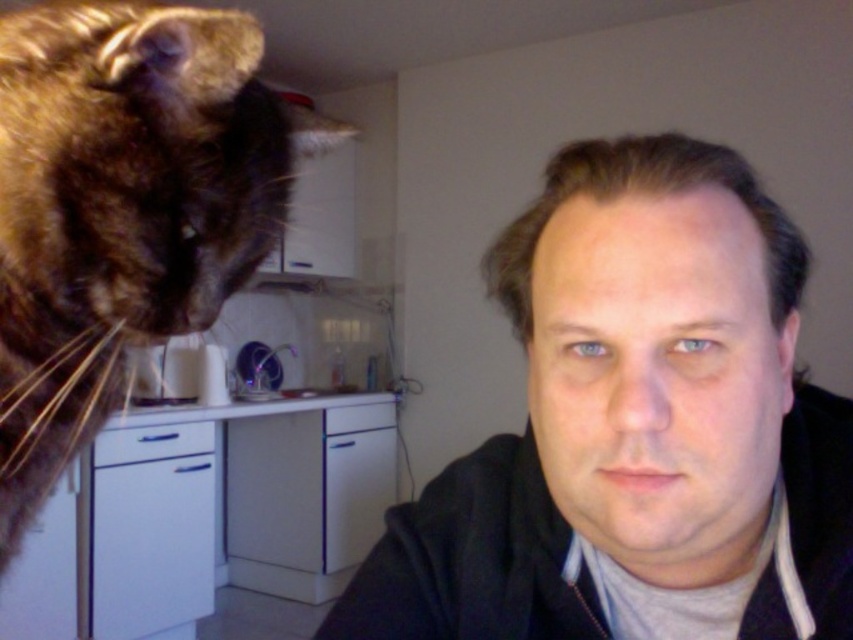
You are a photographer standing 10 feet away from the scene. You want to take a closeup photo of the matte black jacket at center. Can you focus on it clearly without moving closer?

The matte black jacket at center is 13.89 inches away from the viewer. Since 13.89 inches is much closer than 10 feet, you can focus on it clearly without moving closer.

You are a tailor measuring clothes for the man in the scene. You need to adjust the length of the matte black jacket at center so it reaches the same height as the brown fur cat at upper left. How should you modify the jacket?

The matte black jacket at center is currently shorter than the brown fur cat at upper left. To make the jacket reach the same height as the cat, you would need to lengthen it by the difference in their heights.